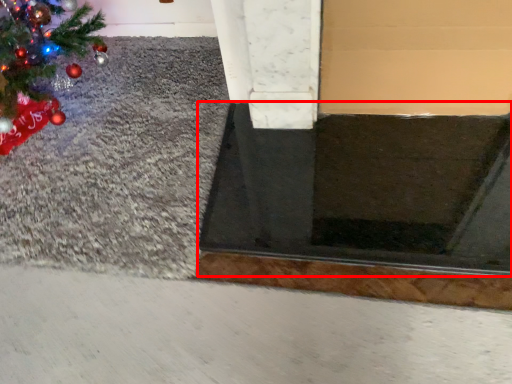
Question: Observing the image, what is the correct spatial positioning of doormat (annotated by the red box) in reference to gravel?

Choices:
 (A) right
 (B) left

Answer: (A)